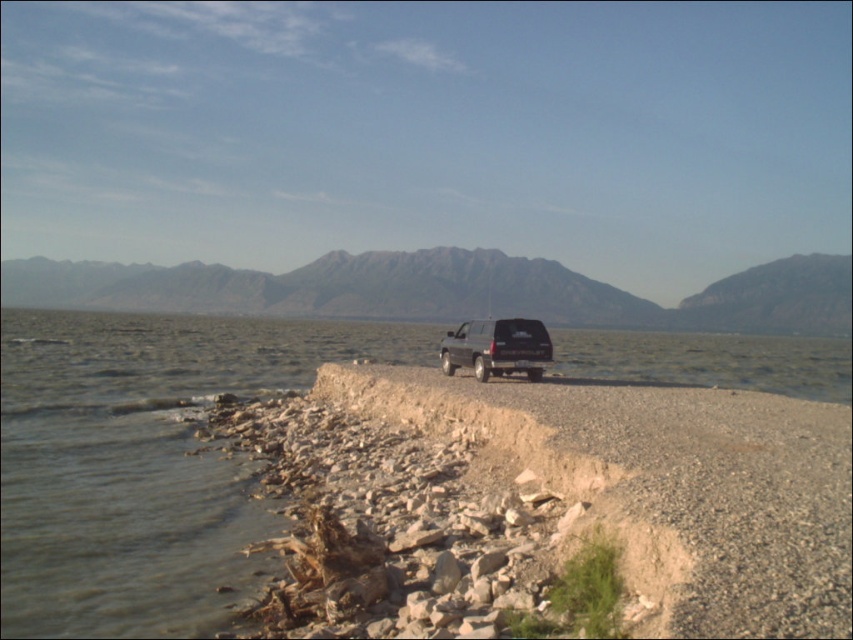
Which is in front, point (259, 346) or point (563, 310)?

Point (259, 346) is more forward.

Who is shorter, clear water at shore right or rugged granite mountain at center?

clear water at shore right

Is point (9, 321) behind point (834, 266)?

That is False.

At what (x,y) coordinates should I click in order to perform the action: click on clear water at shore right. Please return your answer as a coordinate pair (x, y). Looking at the image, I should click on (143, 461).

Can you confirm if clear water at shore right is bigger than shiny black suv at center?

Yes.

Based on the photo, which is below, clear water at shore right or shiny black suv at center?

shiny black suv at center is below.

Based on the photo, who is more forward, (785, 340) or (531, 323)?

Point (531, 323)

The height and width of the screenshot is (640, 853). I want to click on clear water at shore right, so click(x=143, y=461).

Is point (175, 289) positioned after point (456, 340)?

Yes, it is behind point (456, 340).

Who is more forward, (721, 324) or (461, 344)?

Point (461, 344) is more forward.

The height and width of the screenshot is (640, 853). Find the location of `rugged granite mountain at center`. rugged granite mountain at center is located at coordinates (445, 291).